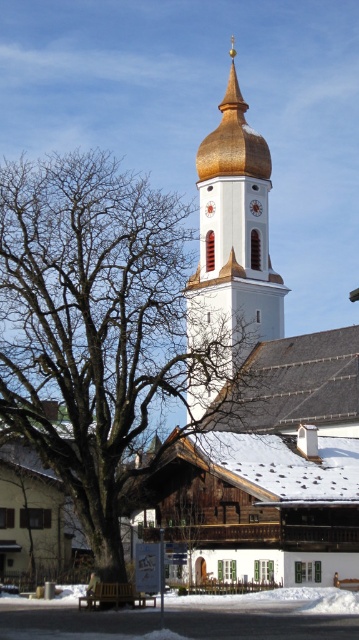
You are planning to take a photo of the white smooth tower at center and want to include the bare wood tree at left in the frame. Based on their widths, will the tree likely occupy more or less space in the photo compared to the tower?

The bare wood tree at left might be wider than white smooth tower at center, so it will likely occupy more space in the photo compared to the tower.

You are standing in the park and want to take a photo of the white smooth tower at center. There is a bare wood tree at left in the way. Can you move to the right side of the tree to get a clear view of the tower?

The bare wood tree at left is in front of the white smooth tower at center, so moving to the right side of the tree would allow you to see the tower without obstruction.

You are visiting a park and see the bare wood tree at left and the white smooth tower at center. Which object is closer to you based on their positions?

The bare wood tree at left is closer to you because it is positioned under the white smooth tower at center, indicating it is in the foreground.